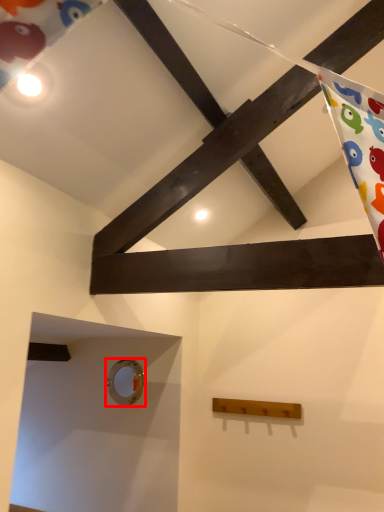
Question: From the image's perspective, what is the correct spatial positioning of hole (annotated by the red box) in reference to plank?

Choices:
 (A) above
 (B) below

Answer: (A)